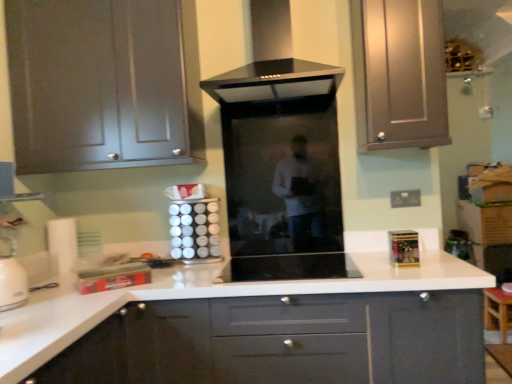
Question: Looking at the image, does matte gray cabinet at upper left, acting as the 3th cabinetry starting from the bottom, seem bigger or smaller compared to black glass range hood at center?

Choices:
 (A) small
 (B) big

Answer: (B)

Question: From their relative heights in the image, would you say matte gray cabinet at upper left, acting as the 3th cabinetry starting from the bottom, is taller or shorter than black glass range hood at center?

Choices:
 (A) tall
 (B) short

Answer: (A)

Question: Estimate the real-world distances between objects in this image. Which object is farther from the transparent glass door at center?

Choices:
 (A) gold metallic spice rack at right, the first appliance when ordered from right to left
 (B) white glossy canisters at center, the 2th appliance from the left
 (C) black glass range hood at center
 (D) matte gray cabinet at upper left, acting as the 1th cabinetry starting from the top
 (E) black glass cooktop at center, the 3th appliance positioned from the left

Answer: (D)

Question: Based on their relative distances, which object is nearer to the black glass cooktop at center, the 3th appliance positioned from the left?

Choices:
 (A) transparent glass door at center
 (B) matte gray cabinet at upper left, acting as the 3th cabinetry starting from the bottom
 (C) satin silver cabinet at upper right, acting as the second cabinetry starting from the bottom
 (D) metallic silver toaster at lower left, which is the 4th appliance in right-to-left order
 (E) gold metallic spice rack at right, the first appliance when ordered from right to left

Answer: (E)